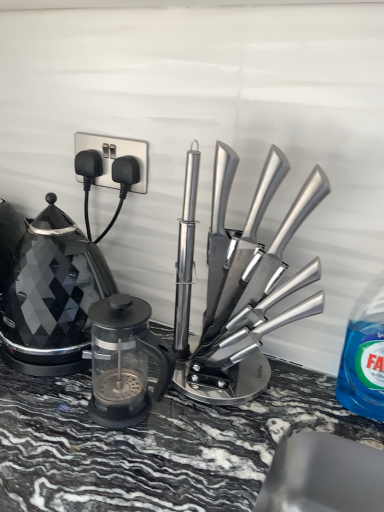
Question: Considering the relative positions of transparent glass french press at center, acting as the first kitchen appliance starting from the left, and blue translucent liquid at right in the image provided, is transparent glass french press at center, acting as the first kitchen appliance starting from the left, behind blue translucent liquid at right?

Choices:
 (A) yes
 (B) no

Answer: (B)

Question: Does transparent glass french press at center, which is counted as the second kitchen appliance, starting from the right, appear on the left side of blue translucent liquid at right?

Choices:
 (A) no
 (B) yes

Answer: (B)

Question: Is transparent glass french press at center, which is counted as the second kitchen appliance, starting from the right, oriented away from blue translucent liquid at right?

Choices:
 (A) yes
 (B) no

Answer: (B)

Question: Considering the relative sizes of transparent glass french press at center, which is counted as the second kitchen appliance, starting from the right, and blue translucent liquid at right in the image provided, is transparent glass french press at center, which is counted as the second kitchen appliance, starting from the right, smaller than blue translucent liquid at right?

Choices:
 (A) no
 (B) yes

Answer: (A)

Question: Can we say transparent glass french press at center, which is counted as the second kitchen appliance, starting from the right, lies outside blue translucent liquid at right?

Choices:
 (A) yes
 (B) no

Answer: (A)

Question: Looking at the image, does black glass kettle at left seem bigger or smaller compared to polished stainless steel knife block at center, the first kitchen appliance in the right-to-left sequence?

Choices:
 (A) small
 (B) big

Answer: (A)

Question: From the image's perspective, relative to polished stainless steel knife block at center, the first kitchen appliance in the right-to-left sequence, is black glass kettle at left above or below?

Choices:
 (A) above
 (B) below

Answer: (B)

Question: Is point (26, 298) closer or farther from the camera than point (291, 321)?

Choices:
 (A) farther
 (B) closer

Answer: (B)

Question: In terms of height, does black glass kettle at left look taller or shorter compared to polished stainless steel knife block at center, the first kitchen appliance in the right-to-left sequence?

Choices:
 (A) tall
 (B) short

Answer: (B)

Question: From a real-world perspective, relative to transparent glass french press at center, which is counted as the second kitchen appliance, starting from the right, is silver metallic plug at upper left vertically above or below?

Choices:
 (A) above
 (B) below

Answer: (A)

Question: Is silver metallic plug at upper left inside or outside of transparent glass french press at center, acting as the first kitchen appliance starting from the left?

Choices:
 (A) inside
 (B) outside

Answer: (B)

Question: Is silver metallic plug at upper left taller or shorter than transparent glass french press at center, which is counted as the second kitchen appliance, starting from the right?

Choices:
 (A) tall
 (B) short

Answer: (B)

Question: In terms of width, does silver metallic plug at upper left look wider or thinner when compared to transparent glass french press at center, acting as the first kitchen appliance starting from the left?

Choices:
 (A) thin
 (B) wide

Answer: (A)

Question: From the image's perspective, is black glass kettle at left positioned above or below silver metallic plug at upper left?

Choices:
 (A) above
 (B) below

Answer: (B)

Question: Looking at their shapes, would you say black glass kettle at left is wider or thinner than silver metallic plug at upper left?

Choices:
 (A) wide
 (B) thin

Answer: (A)